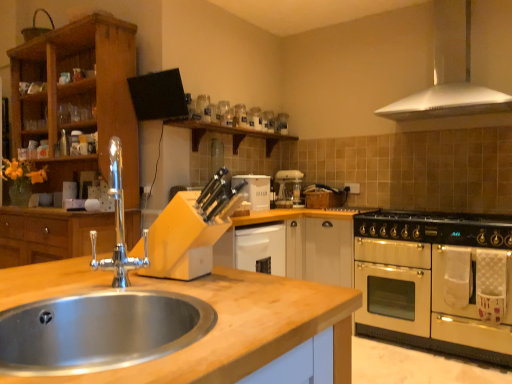
Question: Is white matte bread bin at center touching white plastic coffee machine at center?

Choices:
 (A) yes
 (B) no

Answer: (B)

Question: Can we say white matte bread bin at center lies outside white plastic coffee machine at center?

Choices:
 (A) yes
 (B) no

Answer: (A)

Question: Is white matte bread bin at center surrounding white plastic coffee machine at center?

Choices:
 (A) yes
 (B) no

Answer: (B)

Question: Can you confirm if white matte bread bin at center is shorter than white plastic coffee machine at center?

Choices:
 (A) yes
 (B) no

Answer: (A)

Question: Considering the relative sizes of white matte bread bin at center and white plastic coffee machine at center in the image provided, is white matte bread bin at center wider than white plastic coffee machine at center?

Choices:
 (A) no
 (B) yes

Answer: (B)

Question: From their relative heights in the image, would you say polished chrome faucet at sink left is taller or shorter than cream matte oven at right?

Choices:
 (A) tall
 (B) short

Answer: (B)

Question: Is polished chrome faucet at sink left wider or thinner than cream matte oven at right?

Choices:
 (A) thin
 (B) wide

Answer: (A)

Question: From a real-world perspective, is polished chrome faucet at sink left positioned above or below cream matte oven at right?

Choices:
 (A) below
 (B) above

Answer: (B)

Question: Looking at the image, does polished chrome faucet at sink left seem bigger or smaller compared to cream matte oven at right?

Choices:
 (A) small
 (B) big

Answer: (A)

Question: Is wooden cabinet at left in front of or behind black matte gas stove at right in the image?

Choices:
 (A) front
 (B) behind

Answer: (B)

Question: Is wooden cabinet at left inside or outside of black matte gas stove at right?

Choices:
 (A) inside
 (B) outside

Answer: (B)

Question: Is point (45, 81) positioned closer to the camera than point (429, 233)?

Choices:
 (A) closer
 (B) farther

Answer: (B)

Question: From their relative heights in the image, would you say wooden cabinet at left is taller or shorter than black matte gas stove at right?

Choices:
 (A) tall
 (B) short

Answer: (A)

Question: From a real-world perspective, is stainless steel sink at lower left positioned above or below white matte bread bin at center?

Choices:
 (A) below
 (B) above

Answer: (A)

Question: From the image's perspective, is stainless steel sink at lower left located above or below white matte bread bin at center?

Choices:
 (A) above
 (B) below

Answer: (B)